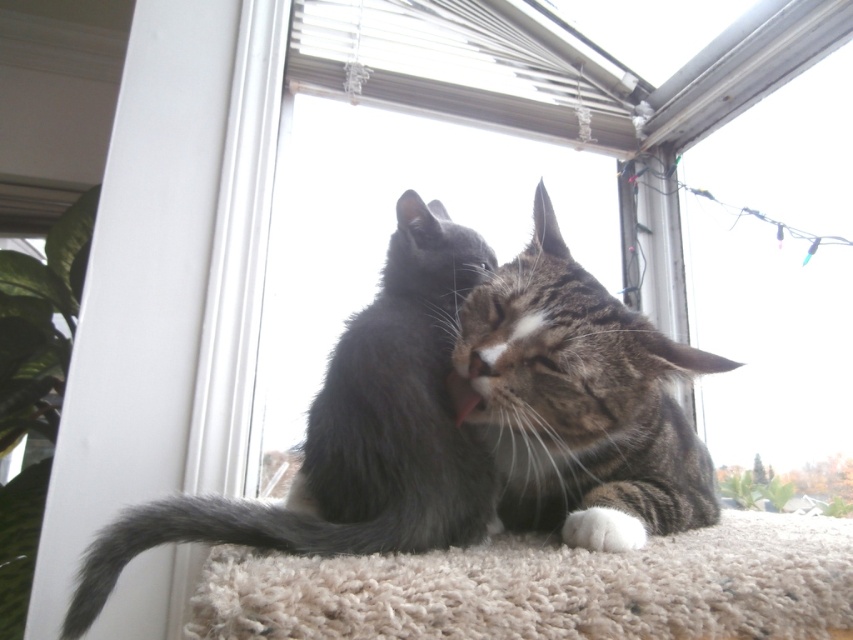
Who is shorter, gray fluffy cat at center or tabby fur cat at center?

gray fluffy cat at center is shorter.

Which is more to the left, gray fluffy cat at center or tabby fur cat at center?

gray fluffy cat at center is more to the left.

Which is behind, point (265, 536) or point (498, 298)?

The point (498, 298) is behind.

Where is `gray fluffy cat at center`? This screenshot has width=853, height=640. gray fluffy cat at center is located at coordinates (352, 435).